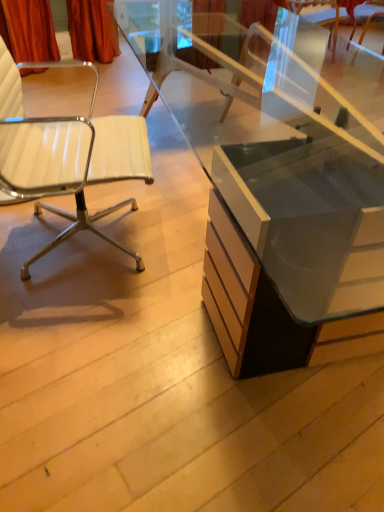
Question: Looking at their shapes, would you say white leather chair at upper right, arranged as the 2th chair when viewed from the left, is wider or thinner than white leather chair at left, the 2th chair in the right-to-left sequence?

Choices:
 (A) wide
 (B) thin

Answer: (B)

Question: Does point (364, 32) appear closer or farther from the camera than point (57, 243)?

Choices:
 (A) closer
 (B) farther

Answer: (B)

Question: Based on their relative distances, which object is farther from the white leather chair at upper right, arranged as the 2th chair when viewed from the left?

Choices:
 (A) white leather chair at left, which ranks as the 2th chair in back-to-front order
 (B) matte glass desk at center

Answer: (A)

Question: Which object is the farthest from the white leather chair at upper right, marked as the second chair in a front-to-back arrangement?

Choices:
 (A) matte glass desk at center
 (B) white leather chair at left, which is the first chair in left-to-right order

Answer: (B)